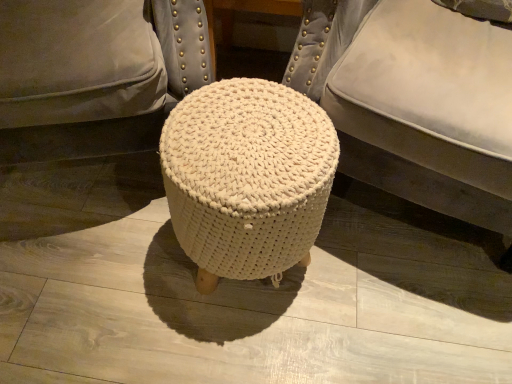
Question: In the image, is white knitted stool at center on the left side or the right side of white knitted pouf at center?

Choices:
 (A) left
 (B) right

Answer: (A)

Question: Is point (196, 223) closer or farther from the camera than point (476, 117)?

Choices:
 (A) farther
 (B) closer

Answer: (A)

Question: Is white knitted stool at center wider or thinner than white knitted pouf at center?

Choices:
 (A) wide
 (B) thin

Answer: (B)

Question: Considering the relative positions of white knitted pouf at center and white knitted stool at center in the image provided, is white knitted pouf at center to the left or to the right of white knitted stool at center?

Choices:
 (A) right
 (B) left

Answer: (A)

Question: From a real-world perspective, is white knitted pouf at center above or below white knitted stool at center?

Choices:
 (A) above
 (B) below

Answer: (A)

Question: Relative to white knitted stool at center, is white knitted pouf at center in front or behind?

Choices:
 (A) behind
 (B) front

Answer: (B)

Question: In terms of height, does white knitted pouf at center look taller or shorter compared to white knitted stool at center?

Choices:
 (A) tall
 (B) short

Answer: (A)